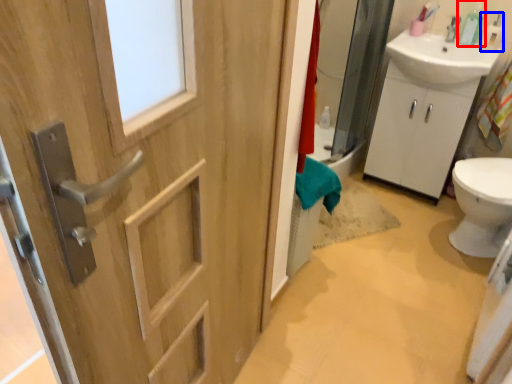
Question: Which object appears farthest to the camera in this image, soap dispenser (highlighted by a red box) or toiletry (highlighted by a blue box)?

Choices:
 (A) soap dispenser
 (B) toiletry

Answer: (A)